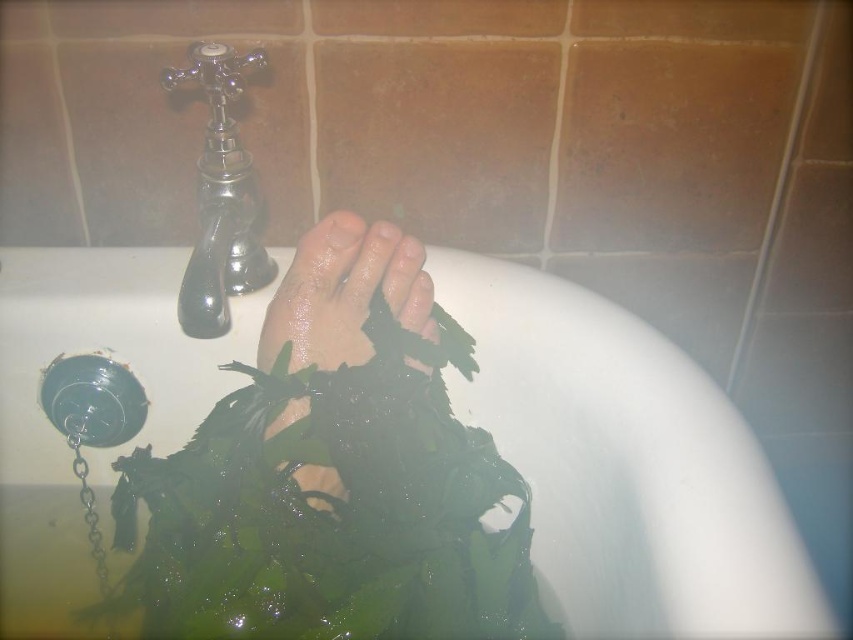
You are a robot trying to navigate between two points in the bathroom. The first point is at point (454, 301) and the second point is at point (393, 253). Which point is closer to the bathtub drain?

Point (393, 253) is closer to the bathtub drain because it is in front of point (454, 301), which is behind it.

You are taking a photo of the bathtub scene. You want to focus on the point closer to the camera. Which point should you choose between point (776, 516) and point (200, 58)?

Point (776, 516) is closer to the camera than point (200, 58), so you should choose point (776, 516) to focus on.